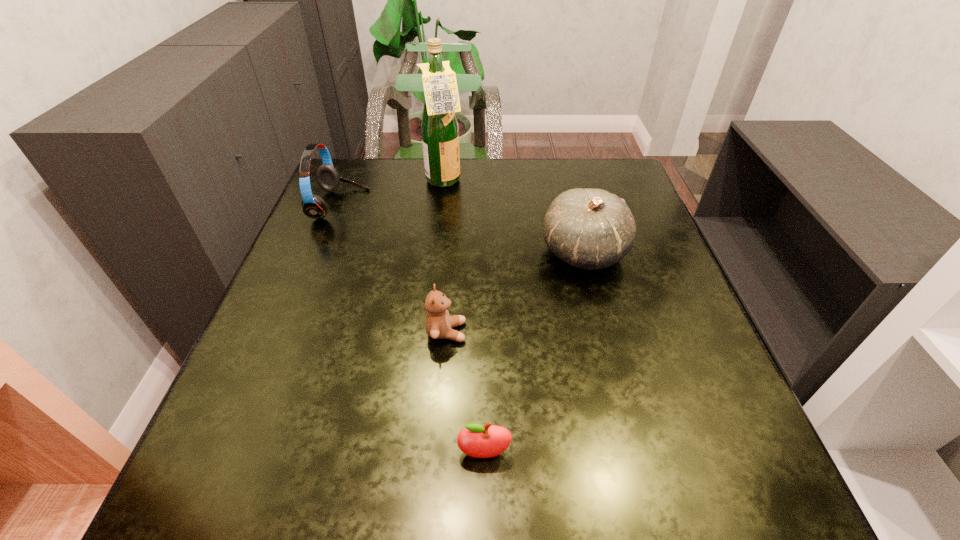
You are a GUI agent. You are given a task and a screenshot of the screen. Output one action in this format:
    pyautogui.click(x=<x>, y=<y>)
    Task: Click on the free space located 0.320m on the front-facing side of the teddy bear
    
    Given the screenshot: What is the action you would take?
    pyautogui.click(x=629, y=332)

Identify the location of free location located 0.150m on the left of the nearest object. The width and height of the screenshot is (960, 540). (363, 453).

Identify the location of liquor located at the far edge. The height and width of the screenshot is (540, 960). (440, 135).

Where is `headset positioned at the far edge`? This screenshot has height=540, width=960. headset positioned at the far edge is located at coordinates (313, 206).

The image size is (960, 540). In order to click on object that is positioned at the near edge in this screenshot , I will do `click(476, 440)`.

Image resolution: width=960 pixels, height=540 pixels. What are the coordinates of `object located at the left edge` in the screenshot? It's located at (313, 206).

Locate an element on the screen. The height and width of the screenshot is (540, 960). object that is at the right edge is located at coordinates (591, 229).

Where is `object that is at the far left corner`? The height and width of the screenshot is (540, 960). object that is at the far left corner is located at coordinates (313, 206).

Identify the location of vacant space at the far edge of the desktop. (492, 180).

The height and width of the screenshot is (540, 960). In the image, there is a desktop. Find the location of `vacant space at the near edge`. vacant space at the near edge is located at coordinates (550, 478).